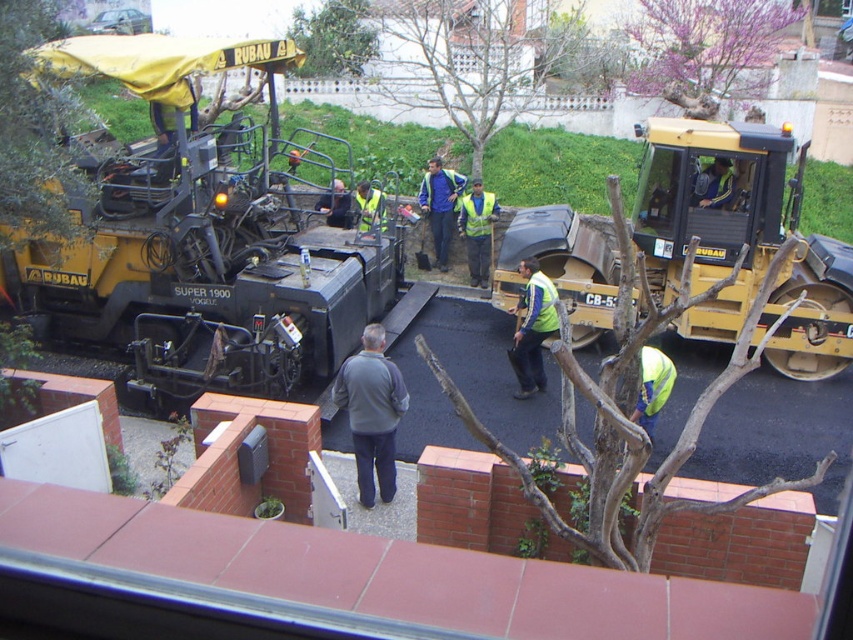
You are observing a construction site from a balcony. You notice two workers near the asphalt paver labeled SUPER 1900. One is wearing a reflective yellow vest at center and the other a gray fleece jacket at center. Which worker is closer to you?

The gray fleece jacket at center is closer to you because it is in front of the reflective yellow vest at center.

You are a safety inspector checking the construction site. You notice the yellow rubber tire compactor at center right and the reflective yellow vest at center. Which object is taller?

The yellow rubber tire compactor at center right is taller than the reflective yellow vest at center.

You are a safety inspector standing at the edge of the construction site. You notice two workers wearing jackets at the center of the scene. The jackets are labeled as gray fleece jacket at center and blue fabric jacket at center. Your task is to check if the distance between them meets the safety protocol requirement of at least 5 meters. Can you confirm if they are compliant?

The gray fleece jacket at center is 6.52 meters away from the blue fabric jacket at center. Since 6.52 meters exceeds the required 5 meters, the workers are compliant with the safety protocol.